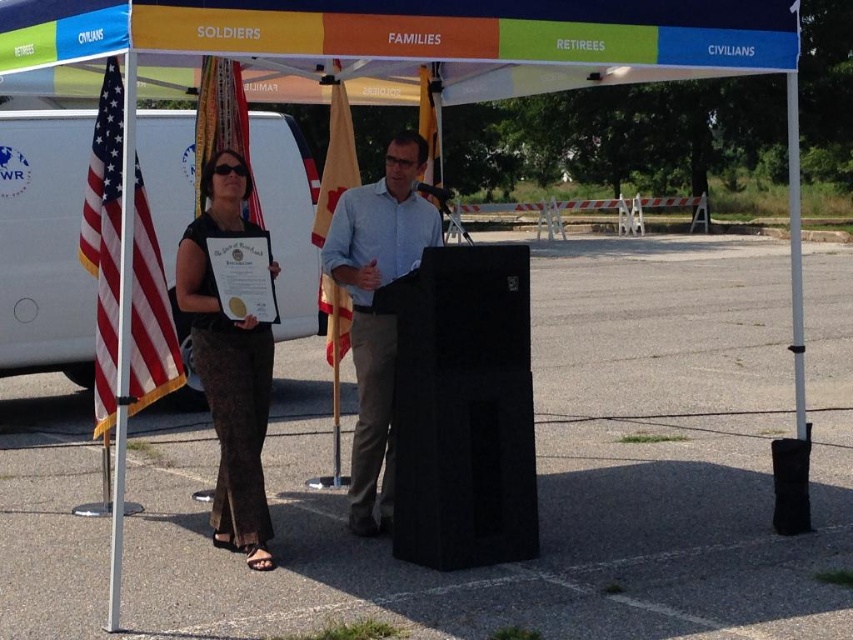
Can you confirm if matte black dress at center is shorter than light blue shirt at center?

In fact, matte black dress at center may be taller than light blue shirt at center.

Between matte black dress at center and light blue shirt at center, which one is positioned lower?

matte black dress at center

Which is in front, point (218, 182) or point (437, 228)?

Point (218, 182)

At what (x,y) coordinates should I click in order to perform the action: click on matte black dress at center. Please return your answer as a coordinate pair (x, y). The image size is (853, 640). Looking at the image, I should click on (229, 364).

Is orange fabric canopy at center positioned in front of silky fabric flag at center?

That is True.

What do you see at coordinates (392, 44) in the screenshot? The image size is (853, 640). I see `orange fabric canopy at center` at bounding box center [392, 44].

Locate an element on the screen. The height and width of the screenshot is (640, 853). orange fabric canopy at center is located at coordinates (392, 44).

Does white matte van at left have a greater height compared to red fabric flag at center?

Yes.

Is point (251, 141) positioned after point (318, 204)?

Yes, point (251, 141) is farther from viewer.

This screenshot has height=640, width=853. Find the location of `white matte van at left`. white matte van at left is located at coordinates (44, 244).